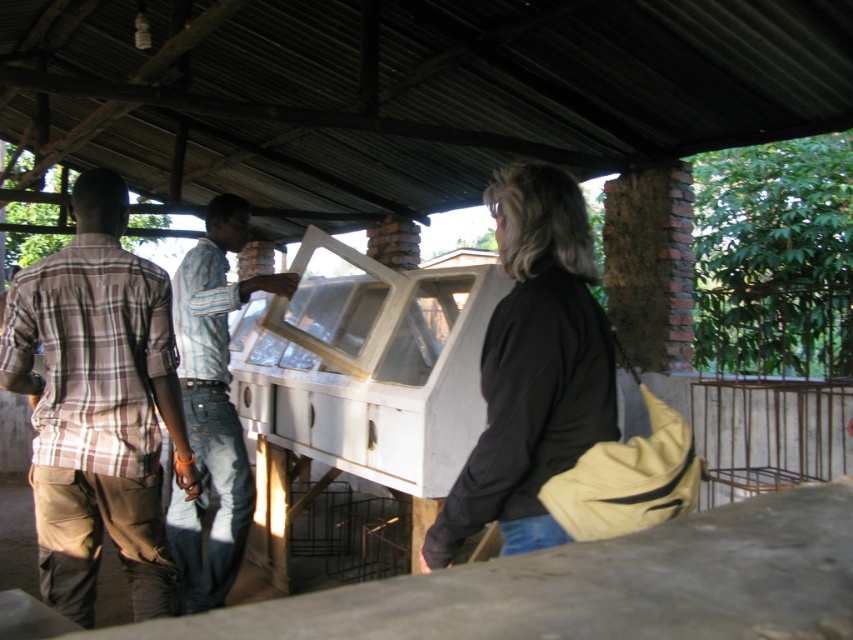
Does plaid cotton shirt at left have a greater width compared to black matte jacket at center?

Yes, plaid cotton shirt at left is wider than black matte jacket at center.

Is plaid cotton shirt at left to the right of black matte jacket at center from the viewer's perspective?

Incorrect, plaid cotton shirt at left is not on the right side of black matte jacket at center.

Between point (137, 456) and point (514, 348), which one is positioned behind?

Positioned behind is point (137, 456).

Where is `plaid cotton shirt at left`? This screenshot has height=640, width=853. plaid cotton shirt at left is located at coordinates (97, 404).

Between plaid cotton shirt at left and striped shirt at center, which one appears on the left side from the viewer's perspective?

From the viewer's perspective, plaid cotton shirt at left appears more on the left side.

Locate an element on the screen. Image resolution: width=853 pixels, height=640 pixels. plaid cotton shirt at left is located at coordinates (97, 404).

Is point (575, 298) positioned behind point (218, 237)?

No, (575, 298) is closer to viewer.

Between point (599, 404) and point (223, 352), which one is positioned behind?

Point (223, 352)

This screenshot has height=640, width=853. Identify the location of black matte jacket at center. (532, 369).